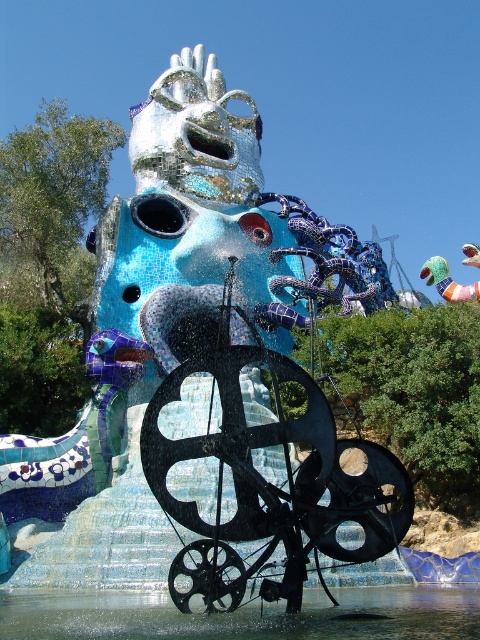
You are standing in front of the sculpture and want to take a photo. You notice two points on the sculpture labeled as point (149, 604) and point (446, 273). Which point will appear larger in your photo?

Point (149, 604) is closer to the camera than point (446, 273), so it will appear larger in the photo.

You are standing in front of the sculpture and want to place a small statue between the clear water at center and the matte pink toy at upper right. What is the minimum distance you need to walk to ensure the statue fits between them?

The minimum distance you need to walk is 67.60 meters, as the clear water at center and the matte pink toy at upper right are 67.60 meters apart.